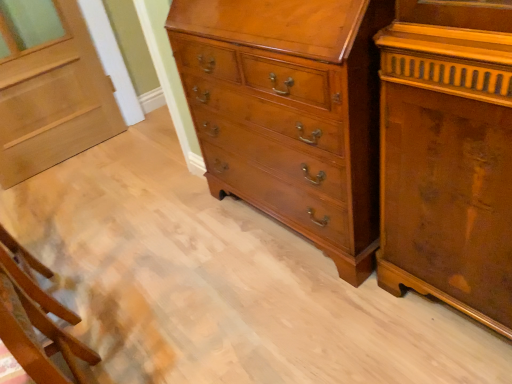
Question: Is glossy wood chest of drawers at center not close to light brown wood door at upper left?

Choices:
 (A) yes
 (B) no

Answer: (A)

Question: From a real-world perspective, is glossy wood chest of drawers at center beneath light brown wood door at upper left?

Choices:
 (A) yes
 (B) no

Answer: (B)

Question: Is glossy wood chest of drawers at center aimed at light brown wood door at upper left?

Choices:
 (A) yes
 (B) no

Answer: (B)

Question: Considering the relative sizes of glossy wood chest of drawers at center and light brown wood door at upper left in the image provided, is glossy wood chest of drawers at center bigger than light brown wood door at upper left?

Choices:
 (A) no
 (B) yes

Answer: (B)

Question: Is glossy wood chest of drawers at center further to the viewer compared to light brown wood door at upper left?

Choices:
 (A) yes
 (B) no

Answer: (B)

Question: Based on their sizes in the image, would you say light brown wood door at upper left is bigger or smaller than wooden chair at lower left?

Choices:
 (A) small
 (B) big

Answer: (A)

Question: Is light brown wood door at upper left to the left or to the right of wooden chair at lower left in the image?

Choices:
 (A) left
 (B) right

Answer: (A)

Question: Is light brown wood door at upper left wider or thinner than wooden chair at lower left?

Choices:
 (A) wide
 (B) thin

Answer: (B)

Question: From a real-world perspective, relative to wooden chair at lower left, is light brown wood door at upper left vertically above or below?

Choices:
 (A) above
 (B) below

Answer: (A)

Question: Relative to glossy wood chest of drawers at center, is light brown wood door at upper left in front or behind?

Choices:
 (A) front
 (B) behind

Answer: (B)

Question: In terms of height, does light brown wood door at upper left look taller or shorter compared to glossy wood chest of drawers at center?

Choices:
 (A) tall
 (B) short

Answer: (B)

Question: In terms of size, does light brown wood door at upper left appear bigger or smaller than glossy wood chest of drawers at center?

Choices:
 (A) small
 (B) big

Answer: (A)

Question: Is light brown wood door at upper left spatially inside glossy wood chest of drawers at center, or outside of it?

Choices:
 (A) inside
 (B) outside

Answer: (B)

Question: Visually, is wooden chair at lower left positioned to the left or to the right of glossy wood chest of drawers at center?

Choices:
 (A) left
 (B) right

Answer: (A)

Question: Is wooden chair at lower left in front of or behind glossy wood chest of drawers at center in the image?

Choices:
 (A) behind
 (B) front

Answer: (B)